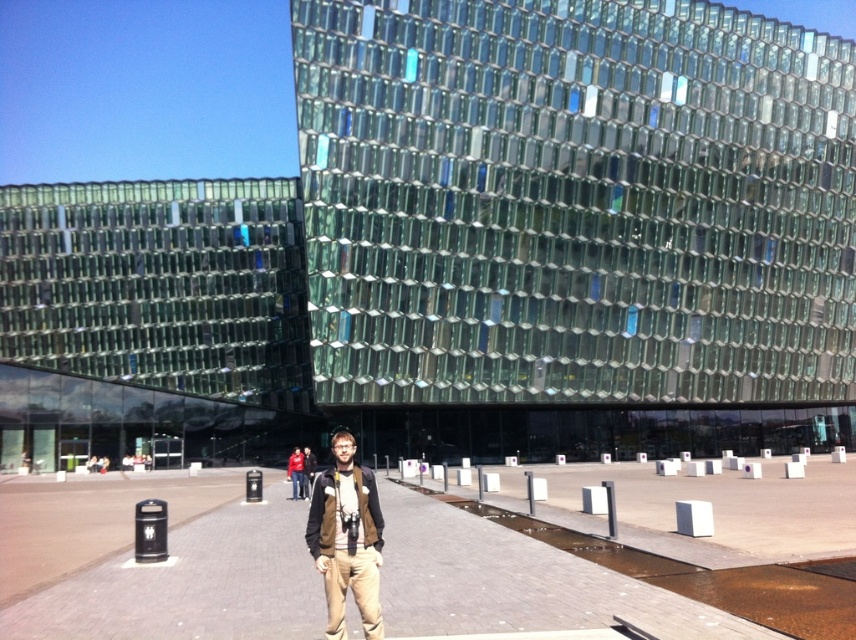
Question: Among these objects, which one is farthest from the camera?

Choices:
 (A) brown leather jacket at center
 (B) brick pavement at center

Answer: (B)

Question: Is brick pavement at center to the right of brown leather jacket at center from the viewer's perspective?

Choices:
 (A) yes
 (B) no

Answer: (B)

Question: Is brick pavement at center to the left of brown leather jacket at center from the viewer's perspective?

Choices:
 (A) yes
 (B) no

Answer: (A)

Question: Can you confirm if brick pavement at center is positioned to the left of brown leather jacket at center?

Choices:
 (A) yes
 (B) no

Answer: (A)